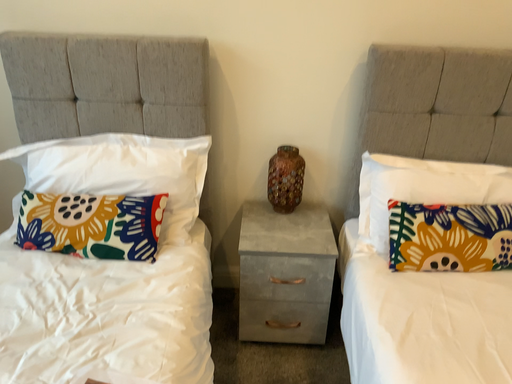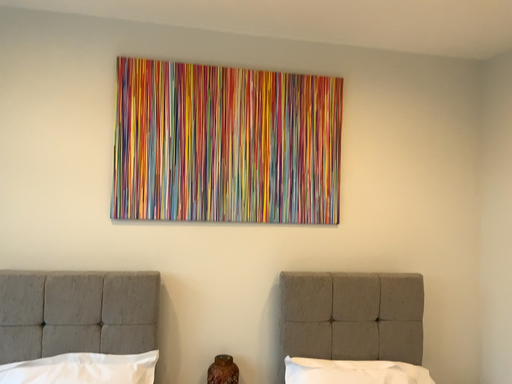
Question: Which way did the camera rotate in the video?

Choices:
 (A) rotated left
 (B) rotated right

Answer: (B)